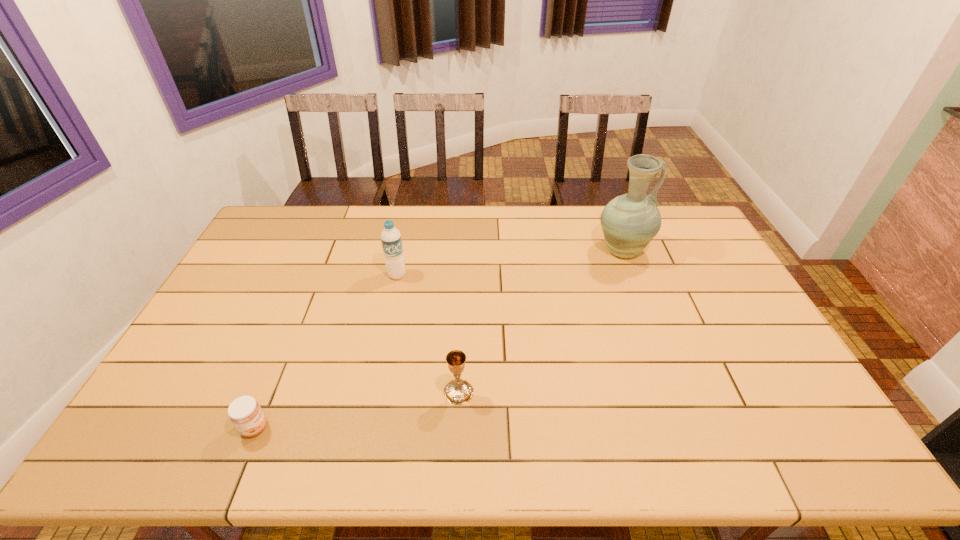
The width and height of the screenshot is (960, 540). In order to click on object that can be found as the third closest to the rightmost object in this screenshot , I will do `click(245, 413)`.

Identify the location of vacant point that satisfies the following two spatial constraints: 1. on the handle side of the tallest object; 2. on the front side of the third tallest object. (676, 392).

Where is `vacant space that satisfies the following two spatial constraints: 1. on the label of the chalice; 2. on the left side of the third object from right to left`? This screenshot has width=960, height=540. vacant space that satisfies the following two spatial constraints: 1. on the label of the chalice; 2. on the left side of the third object from right to left is located at coordinates (372, 392).

Locate an element on the screen. vacant region that satisfies the following two spatial constraints: 1. on the handle side of the pitcher; 2. on the label of the second object from left to right is located at coordinates (632, 275).

The width and height of the screenshot is (960, 540). I want to click on vacant area in the image that satisfies the following two spatial constraints: 1. on the label of the chalice; 2. on the left side of the third object from right to left, so click(x=372, y=392).

Image resolution: width=960 pixels, height=540 pixels. Identify the location of free spot that satisfies the following two spatial constraints: 1. on the handle side of the tallest object; 2. on the label of the water bottle. (632, 275).

Find the location of a particular element. free space in the image that satisfies the following two spatial constraints: 1. on the handle side of the rightmost object; 2. on the label of the water bottle is located at coordinates (632, 275).

At what (x,y) coordinates should I click in order to perform the action: click on free space that satisfies the following two spatial constraints: 1. on the handle side of the pitcher; 2. on the label of the water bottle. Please return your answer as a coordinate pair (x, y). Looking at the image, I should click on (632, 275).